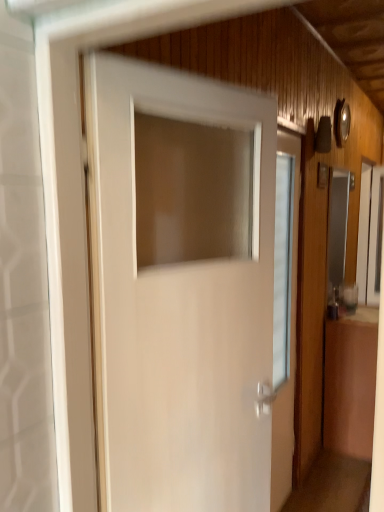
Identify the location of free space above white glossy door at center (from a real-world perspective). The image size is (384, 512). (188, 77).